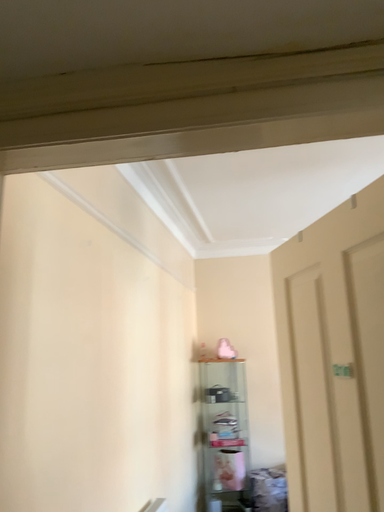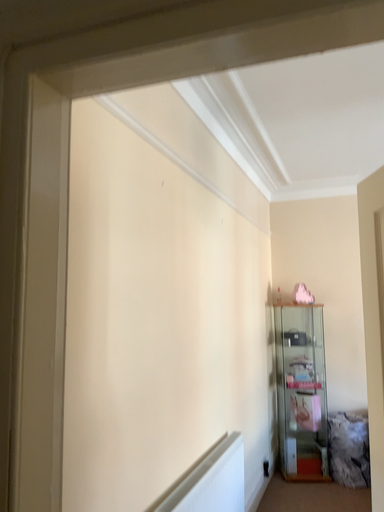
Question: Which way did the camera rotate in the video?

Choices:
 (A) rotated right
 (B) rotated left

Answer: (B)